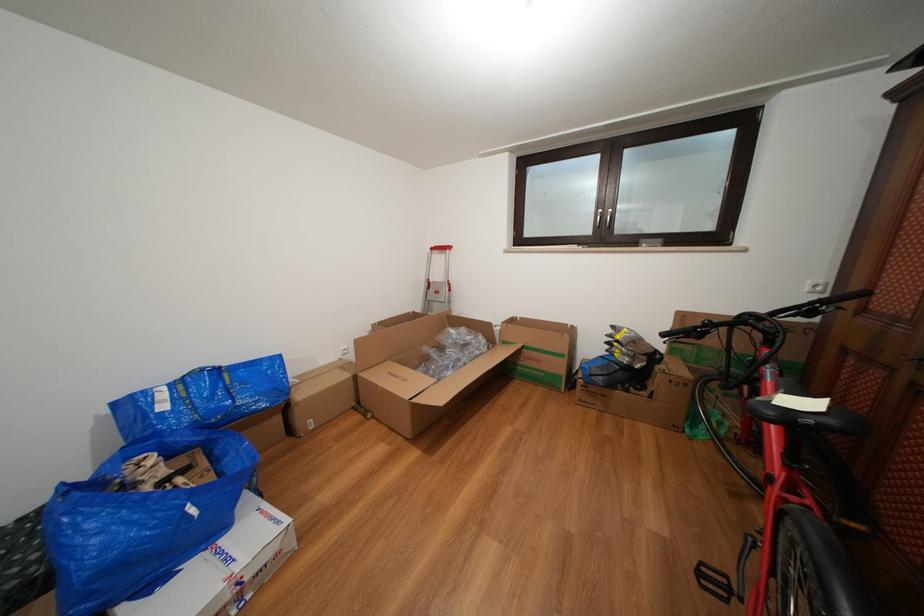
Describe the element at coordinates (833, 302) in the screenshot. I see `the bicycle brake lever` at that location.